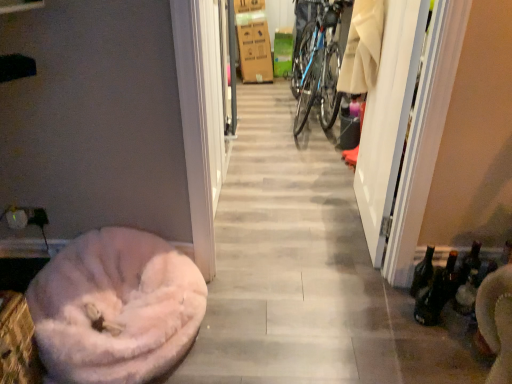
Question: Is white glossy screen door at right thinner than blue metallic bicycle tire at center-right?

Choices:
 (A) no
 (B) yes

Answer: (B)

Question: From the image's perspective, is white glossy screen door at right over blue metallic bicycle tire at center-right?

Choices:
 (A) yes
 (B) no

Answer: (B)

Question: Considering the relative sizes of white glossy screen door at right and blue metallic bicycle tire at center-right in the image provided, is white glossy screen door at right wider than blue metallic bicycle tire at center-right?

Choices:
 (A) yes
 (B) no

Answer: (B)

Question: Is white glossy screen door at right not near blue metallic bicycle tire at center-right?

Choices:
 (A) no
 (B) yes

Answer: (B)

Question: Can you confirm if white glossy screen door at right is positioned to the left of blue metallic bicycle tire at center-right?

Choices:
 (A) no
 (B) yes

Answer: (A)

Question: From the image's perspective, is white glossy screen door at right under blue metallic bicycle tire at center-right?

Choices:
 (A) no
 (B) yes

Answer: (B)

Question: Would you consider white glossy screen door at right to be distant from brown cardboard box at upper center?

Choices:
 (A) no
 (B) yes

Answer: (B)

Question: Is white glossy screen door at right further to camera compared to brown cardboard box at upper center?

Choices:
 (A) no
 (B) yes

Answer: (A)

Question: Does white glossy screen door at right have a greater width compared to brown cardboard box at upper center?

Choices:
 (A) yes
 (B) no

Answer: (B)

Question: From a real-world perspective, is white glossy screen door at right physically above brown cardboard box at upper center?

Choices:
 (A) yes
 (B) no

Answer: (A)

Question: Is white glossy screen door at right not within brown cardboard box at upper center?

Choices:
 (A) no
 (B) yes

Answer: (B)

Question: Considering the relative sizes of white glossy screen door at right and brown cardboard box at upper center in the image provided, is white glossy screen door at right thinner than brown cardboard box at upper center?

Choices:
 (A) yes
 (B) no

Answer: (A)

Question: Considering the relative sizes of brown cardboard box at upper center and blue metallic bicycle at center in the image provided, is brown cardboard box at upper center taller than blue metallic bicycle at center?

Choices:
 (A) yes
 (B) no

Answer: (B)